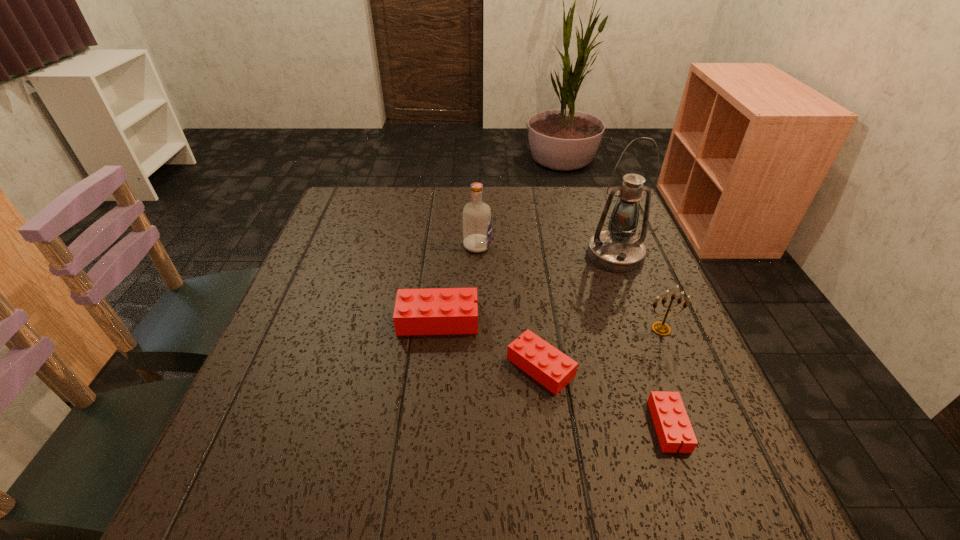
I want to click on vacant space at the far edge of the desktop, so click(x=576, y=227).

Identify the location of vacant space at the near edge of the desktop. This screenshot has width=960, height=540. (324, 431).

In the image, there is a desktop. At what (x,y) coordinates should I click in order to perform the action: click on free region at the left edge. Please return your answer as a coordinate pair (x, y). Looking at the image, I should click on click(x=306, y=303).

The image size is (960, 540). Identify the location of vacant space at the right edge of the desktop. (632, 288).

At what (x,y) coordinates should I click in order to perform the action: click on vacant area at the far left corner. Please return your answer as a coordinate pair (x, y). The height and width of the screenshot is (540, 960). Looking at the image, I should click on click(351, 213).

In the image, there is a desktop. Where is `vacant region at the far right corner`? The height and width of the screenshot is (540, 960). vacant region at the far right corner is located at coordinates (579, 214).

Identify the location of free space between the second tallest object and the candelabrum. pos(569,287).

This screenshot has height=540, width=960. Find the location of `free spot between the tallest object and the farthest Lego`. free spot between the tallest object and the farthest Lego is located at coordinates (527, 287).

You are a GUI agent. You are given a task and a screenshot of the screen. Output one action in this format:
    pyautogui.click(x=<x>, y=<y>)
    Task: Click on the vacant area that lies between the shortest Lego and the second nearest Lego
    Image resolution: width=960 pixels, height=540 pixels.
    Given the screenshot: What is the action you would take?
    [x=605, y=396]

Where is `vacant space that's between the fifth shortest object and the tallest Lego`? vacant space that's between the fifth shortest object and the tallest Lego is located at coordinates (458, 283).